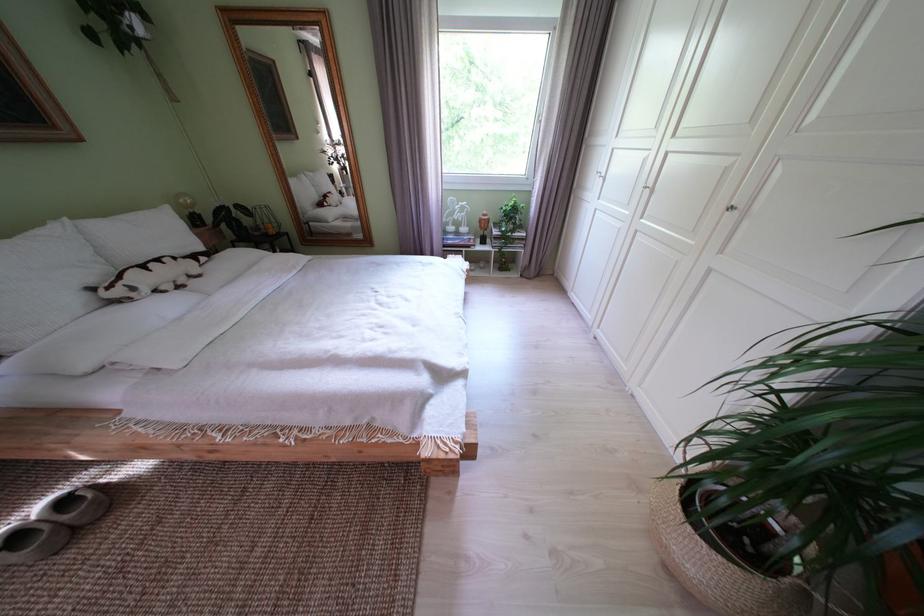
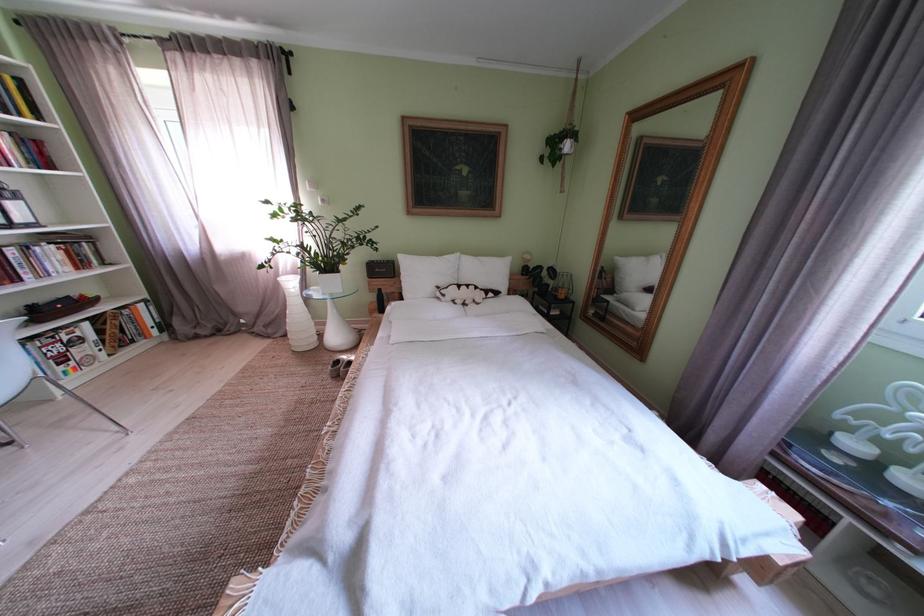
In the second image, find the point that corresponds to (28,543) in the first image.

(348, 367)